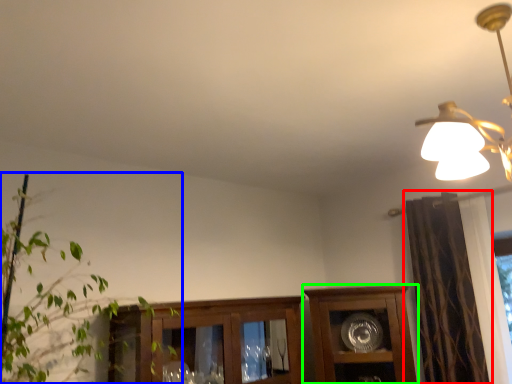
Question: Estimate the real-world distances between objects in this image. Which object is closer to curtain (highlighted by a red box), houseplant (highlighted by a blue box) or cabinetry (highlighted by a green box)?

Choices:
 (A) houseplant
 (B) cabinetry

Answer: (B)